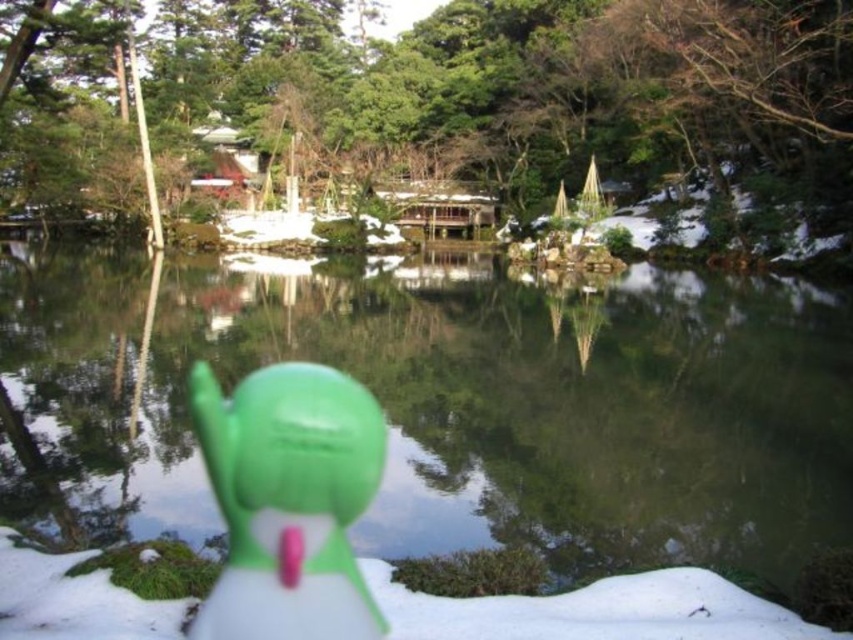
Can you confirm if clear glass water at center is positioned below green matte snowman at center?

No.

Does clear glass water at center have a larger size compared to green matte snowman at center?

Yes, clear glass water at center is bigger than green matte snowman at center.

Image resolution: width=853 pixels, height=640 pixels. What do you see at coordinates (447, 404) in the screenshot?
I see `clear glass water at center` at bounding box center [447, 404].

Find the location of a particular element. clear glass water at center is located at coordinates (447, 404).

Does green matte snowman at center appear over white fluffy snow at lower center?

Yes, green matte snowman at center is above white fluffy snow at lower center.

Based on the photo, between green matte snowman at center and white fluffy snow at lower center, which one has less height?

Standing shorter between the two is white fluffy snow at lower center.

Measure the distance between point (x=219, y=468) and camera.

The distance of point (x=219, y=468) from camera is 29.05 feet.

The image size is (853, 640). I want to click on green matte snowman at center, so click(x=289, y=500).

Between point (746, 112) and point (347, 579), which one is positioned behind?

The point (746, 112) is behind.

How much distance is there between green matte tree at upper center and green matte snowman at center?

green matte tree at upper center is 214.75 feet away from green matte snowman at center.

Image resolution: width=853 pixels, height=640 pixels. Describe the element at coordinates (439, 100) in the screenshot. I see `green matte tree at upper center` at that location.

Find the location of `green matte tree at upper center`. green matte tree at upper center is located at coordinates [439, 100].